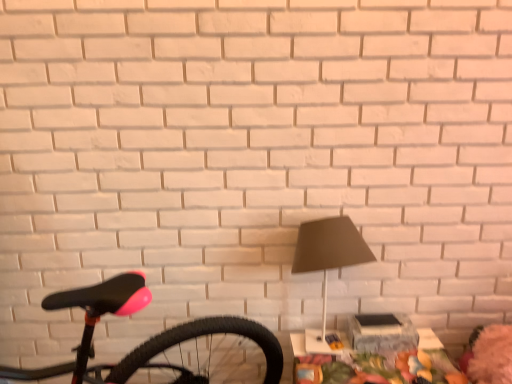
Question: From a real-world perspective, does white glossy table at lower right sit lower than matte black lamp at center?

Choices:
 (A) yes
 (B) no

Answer: (A)

Question: Is white glossy table at lower right positioned with its back to matte black lamp at center?

Choices:
 (A) yes
 (B) no

Answer: (B)

Question: Does white glossy table at lower right turn towards matte black lamp at center?

Choices:
 (A) yes
 (B) no

Answer: (B)

Question: Is white glossy table at lower right next to matte black lamp at center?

Choices:
 (A) no
 (B) yes

Answer: (A)

Question: From the image's perspective, would you say white glossy table at lower right is positioned over matte black lamp at center?

Choices:
 (A) yes
 (B) no

Answer: (B)

Question: Does white glossy table at lower right lie in front of matte black lamp at center?

Choices:
 (A) no
 (B) yes

Answer: (A)

Question: Does matte black lamp at center turn towards white glossy table at lower right?

Choices:
 (A) no
 (B) yes

Answer: (A)

Question: Does matte black lamp at center appear on the left side of white glossy table at lower right?

Choices:
 (A) no
 (B) yes

Answer: (B)

Question: Considering the relative sizes of matte black lamp at center and white glossy table at lower right in the image provided, is matte black lamp at center wider than white glossy table at lower right?

Choices:
 (A) yes
 (B) no

Answer: (B)

Question: Can you confirm if matte black lamp at center is smaller than white glossy table at lower right?

Choices:
 (A) yes
 (B) no

Answer: (A)

Question: Considering the relative positions of matte black lamp at center and white glossy table at lower right in the image provided, is matte black lamp at center behind white glossy table at lower right?

Choices:
 (A) no
 (B) yes

Answer: (A)

Question: Is matte black lamp at center completely or partially outside of white glossy table at lower right?

Choices:
 (A) no
 (B) yes

Answer: (B)

Question: Considering the positions of point pyautogui.click(x=328, y=377) and point pyautogui.click(x=336, y=249), is point pyautogui.click(x=328, y=377) closer or farther from the camera than point pyautogui.click(x=336, y=249)?

Choices:
 (A) closer
 (B) farther

Answer: (B)